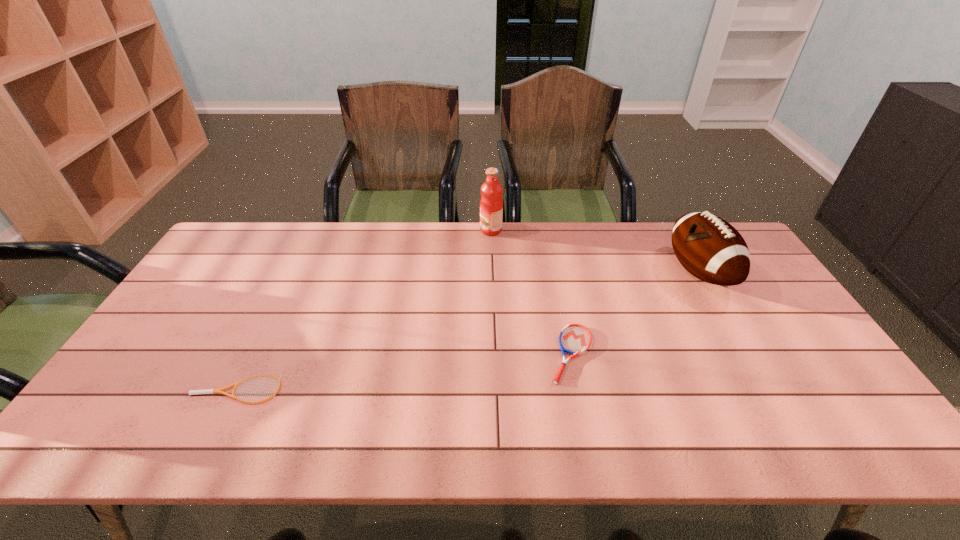
Identify the location of vacant area between the third nearest object and the farthest object. (595, 251).

In order to click on object that is the closest to the leftmost object in this screenshot , I will do `click(574, 339)`.

Select which object appears as the second closest to the right tennis racket. Please provide its 2D coordinates. Your answer should be formatted as a tuple, i.e. [(x, y)], where the tuple contains the x and y coordinates of a point satisfying the conditions above.

[(491, 203)]

Identify the location of free point that satisfies the following two spatial constraints: 1. on the front label of the football (American); 2. on the right side of the third object from right to left. (492, 272).

Find the location of a particular element. Image resolution: width=960 pixels, height=540 pixels. free space that satisfies the following two spatial constraints: 1. on the front label of the right tennis racket; 2. on the left side of the fruit juice is located at coordinates (495, 354).

Find the location of a particular element. The width and height of the screenshot is (960, 540). free region that satisfies the following two spatial constraints: 1. on the front label of the second object from left to right; 2. on the right side of the second farthest object is located at coordinates (492, 272).

Locate an element on the screen. The height and width of the screenshot is (540, 960). vacant space that satisfies the following two spatial constraints: 1. on the back side of the leftmost object; 2. on the left side of the second tallest object is located at coordinates (295, 272).

You are a GUI agent. You are given a task and a screenshot of the screen. Output one action in this format:
    pyautogui.click(x=<x>, y=<y>)
    Task: Click on the blank area in the image that satisfies the following two spatial constraints: 1. on the back side of the second object from right to left; 2. on the front label of the second object from left to right
    Image resolution: width=960 pixels, height=540 pixels.
    Given the screenshot: What is the action you would take?
    pyautogui.click(x=547, y=230)

In order to click on vacant space that satisfies the following two spatial constraints: 1. on the front label of the second object from left to right; 2. on the left side of the right tennis racket in this screenshot , I will do `click(495, 354)`.

Locate an element on the screen. The image size is (960, 540). free space that satisfies the following two spatial constraints: 1. on the front label of the third nearest object; 2. on the right side of the farthest object is located at coordinates (492, 272).